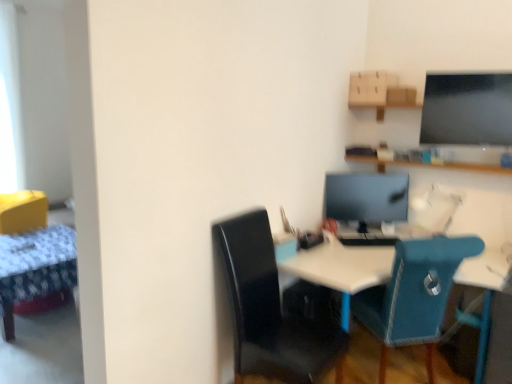
Question: Is matte black monitor at center shorter than white plastic desk at center?

Choices:
 (A) yes
 (B) no

Answer: (A)

Question: From a real-world perspective, does matte black monitor at center stand above white plastic desk at center?

Choices:
 (A) yes
 (B) no

Answer: (A)

Question: Is matte black monitor at center further to camera compared to white plastic desk at center?

Choices:
 (A) no
 (B) yes

Answer: (B)

Question: Is matte black monitor at center bigger than white plastic desk at center?

Choices:
 (A) no
 (B) yes

Answer: (A)

Question: Is matte black monitor at center to the right of white plastic desk at center from the viewer's perspective?

Choices:
 (A) yes
 (B) no

Answer: (B)

Question: Considering their positions, is matte black monitor at center located in front of or behind white plastic desk at center?

Choices:
 (A) behind
 (B) front

Answer: (A)

Question: From a real-world perspective, is matte black monitor at center positioned above or below white plastic desk at center?

Choices:
 (A) below
 (B) above

Answer: (B)

Question: Is matte black monitor at center bigger or smaller than white plastic desk at center?

Choices:
 (A) big
 (B) small

Answer: (B)

Question: From the image's perspective, is matte black monitor at center positioned above or below white plastic desk at center?

Choices:
 (A) below
 (B) above

Answer: (B)

Question: In terms of size, does teal fabric chair at center, acting as the second chair starting from the left, appear bigger or smaller than white plastic desk at center?

Choices:
 (A) small
 (B) big

Answer: (A)

Question: In terms of height, does teal fabric chair at center, which is the first chair from right to left, look taller or shorter compared to white plastic desk at center?

Choices:
 (A) short
 (B) tall

Answer: (B)

Question: Is teal fabric chair at center, acting as the second chair starting from the left, spatially inside white plastic desk at center, or outside of it?

Choices:
 (A) inside
 (B) outside

Answer: (A)

Question: Is point (373, 312) positioned closer to the camera than point (345, 296)?

Choices:
 (A) farther
 (B) closer

Answer: (A)

Question: Considering their positions, is matte black monitor at center located in front of or behind wooden table at left?

Choices:
 (A) behind
 (B) front

Answer: (A)

Question: Is matte black monitor at center bigger or smaller than wooden table at left?

Choices:
 (A) big
 (B) small

Answer: (B)